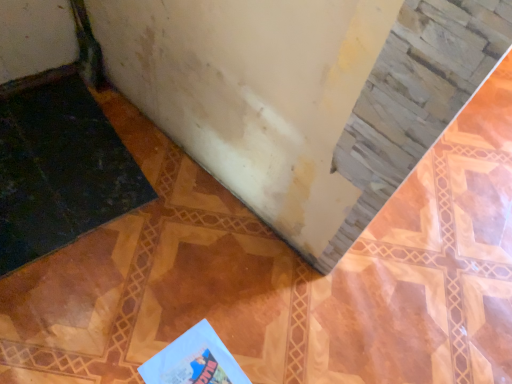
Question: From their relative heights in the image, would you say light blue paper at lower center is taller or shorter than black rubber doormat at lower left?

Choices:
 (A) short
 (B) tall

Answer: (A)

Question: Considering the positions of point (214, 370) and point (61, 185), is point (214, 370) closer or farther from the camera than point (61, 185)?

Choices:
 (A) closer
 (B) farther

Answer: (A)

Question: Is light blue paper at lower center wider or thinner than black rubber doormat at lower left?

Choices:
 (A) wide
 (B) thin

Answer: (B)

Question: Considering the positions of point (59, 218) and point (230, 377), is point (59, 218) closer or farther from the camera than point (230, 377)?

Choices:
 (A) closer
 (B) farther

Answer: (B)

Question: Do you think black rubber doormat at lower left is within light blue paper at lower center, or outside of it?

Choices:
 (A) inside
 (B) outside

Answer: (B)

Question: From the image's perspective, is black rubber doormat at lower left located above or below light blue paper at lower center?

Choices:
 (A) below
 (B) above

Answer: (B)

Question: In terms of width, does black rubber doormat at lower left look wider or thinner when compared to light blue paper at lower center?

Choices:
 (A) thin
 (B) wide

Answer: (B)